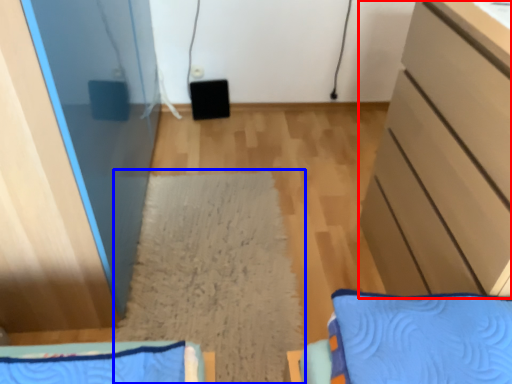
Question: Which of the following is the closest to the observer, cabinetry (highlighted by a red box) or mat (highlighted by a blue box)?

Choices:
 (A) cabinetry
 (B) mat

Answer: (A)